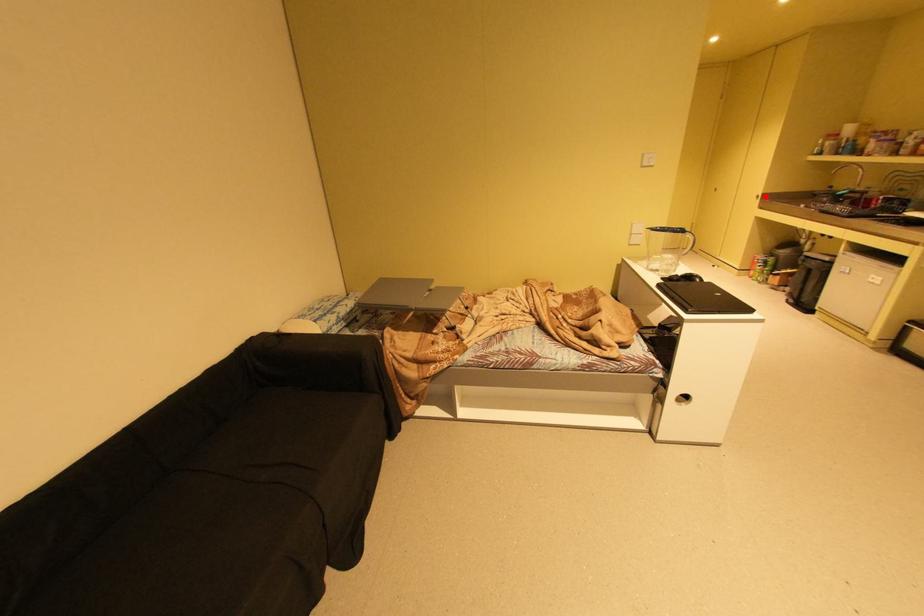
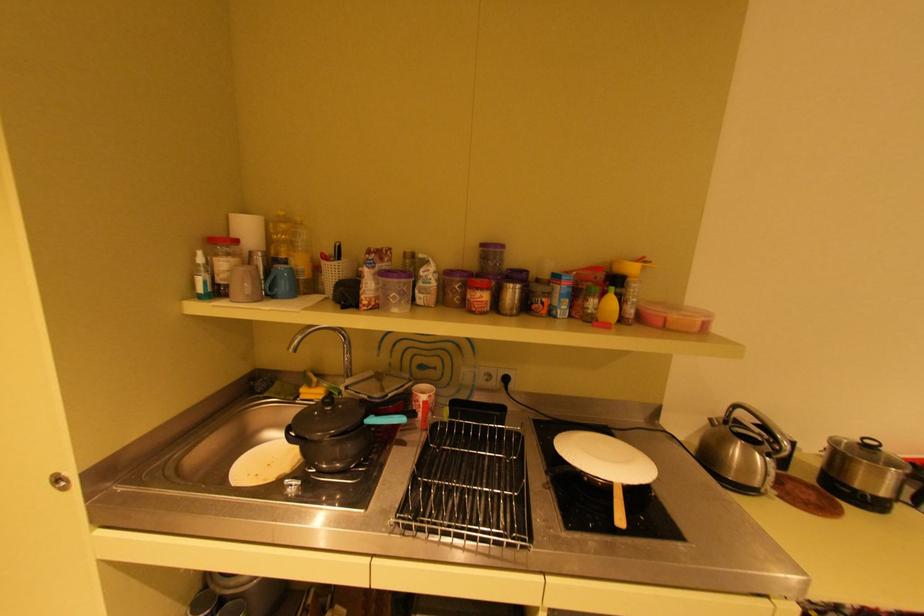
Question: I am providing you with two images of the same scene from different viewpoints. A red point is shown in image1. For the corresponding object point in image2, is it positioned nearer or farther from the camera?

Choices:
 (A) Nearer
 (B) Farther

Answer: (A)